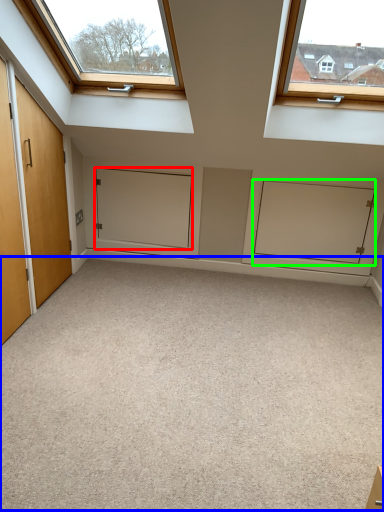
Question: Which object is the farthest from door (highlighted by a red box)? Choose among these: plain (highlighted by a blue box) or cabinetry (highlighted by a green box).

Choices:
 (A) plain
 (B) cabinetry

Answer: (A)